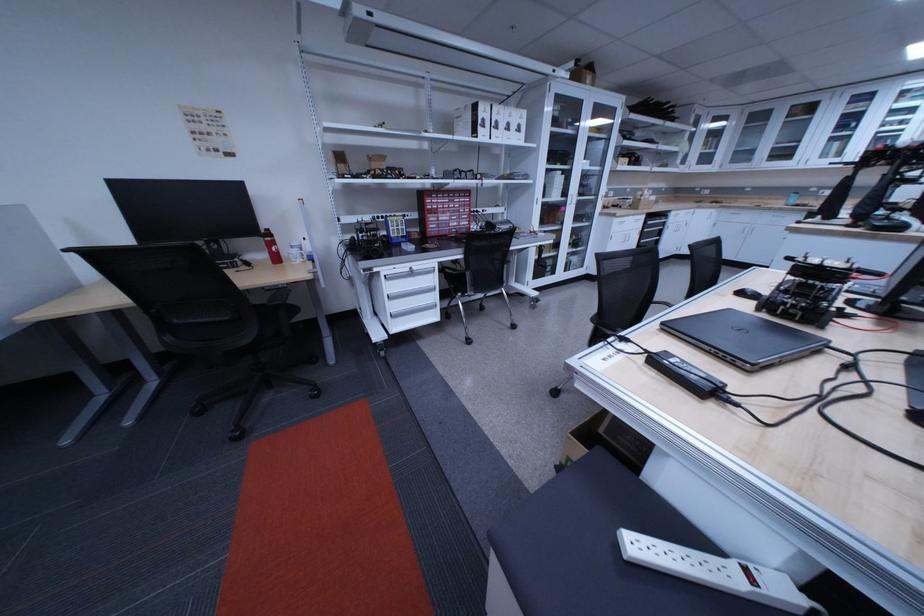
Which object does [749,337] point to?

This point indicates the closed black laptop.